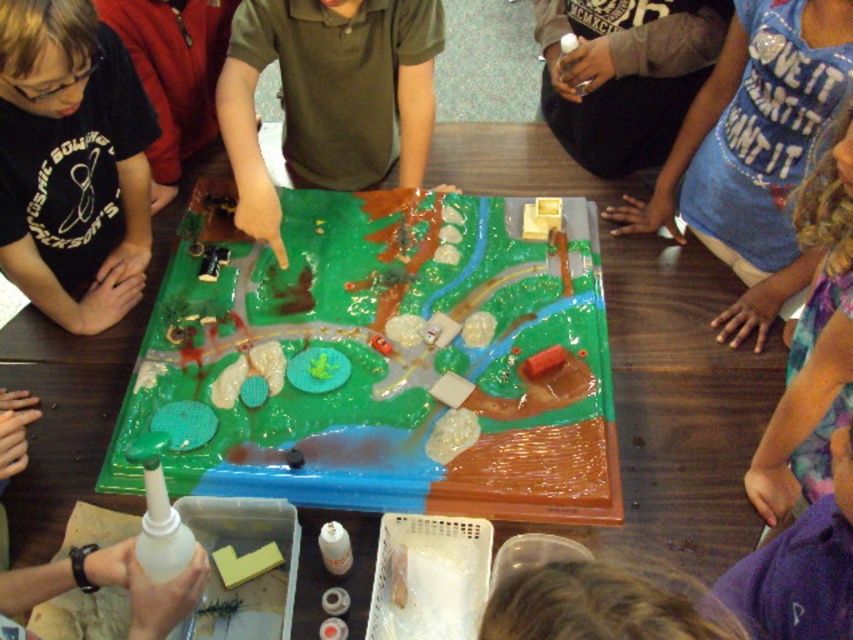
Does green matte board game at center have a greater width compared to purple tie-dye shirt at upper right?

Correct, the width of green matte board game at center exceeds that of purple tie-dye shirt at upper right.

Does point (285, 364) come behind point (802, 317)?

Yes, point (285, 364) is farther from viewer.

You are a GUI agent. You are given a task and a screenshot of the screen. Output one action in this format:
    pyautogui.click(x=<x>, y=<y>)
    Task: Click on the green matte board game at center
    The image size is (853, 640).
    Given the screenshot: What is the action you would take?
    pyautogui.click(x=386, y=362)

Does green matte board game at center have a greater height compared to black matte shirt at upper left?

Indeed, green matte board game at center has a greater height compared to black matte shirt at upper left.

Can you confirm if green matte board game at center is positioned below black matte shirt at upper left?

Correct, green matte board game at center is located below black matte shirt at upper left.

Who is more distant from viewer, (552, 438) or (129, 252)?

Point (129, 252)

I want to click on green matte board game at center, so click(386, 362).

Who is higher up, black matte shirt at upper left or purple tie-dye shirt at upper right?

black matte shirt at upper left

Between point (108, 227) and point (773, 420), which one is positioned in front?

Point (773, 420)

Locate an element on the screen. black matte shirt at upper left is located at coordinates (71, 163).